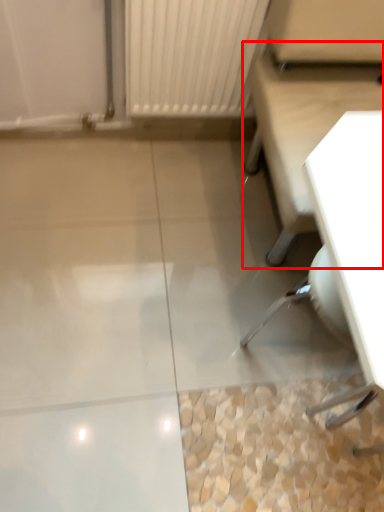
Question: From the image's perspective, what is the correct spatial relationship of furniture (annotated by the red box) in relation to swivel chair?

Choices:
 (A) above
 (B) below

Answer: (A)